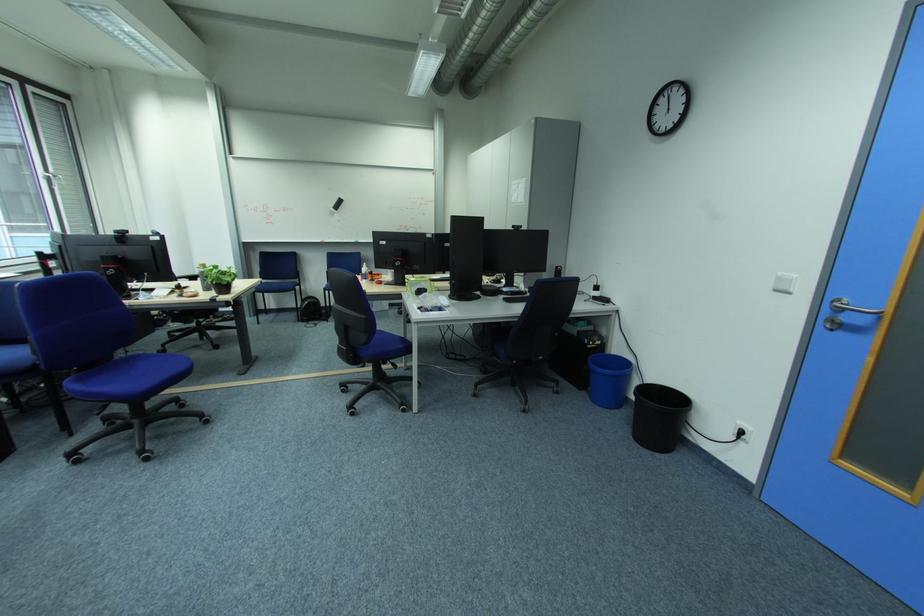
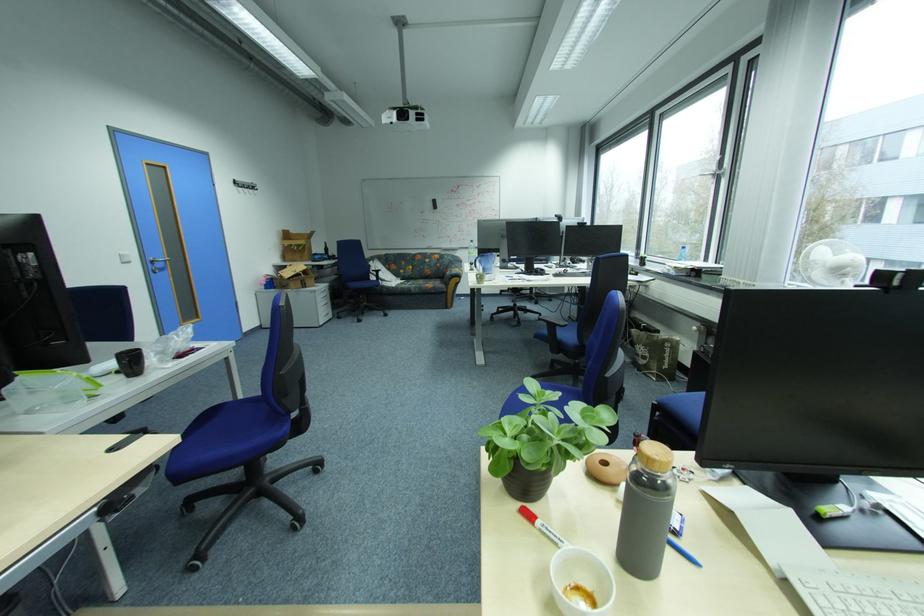
Find the pixel in the second image that matches [791,275] in the first image.

(130, 254)